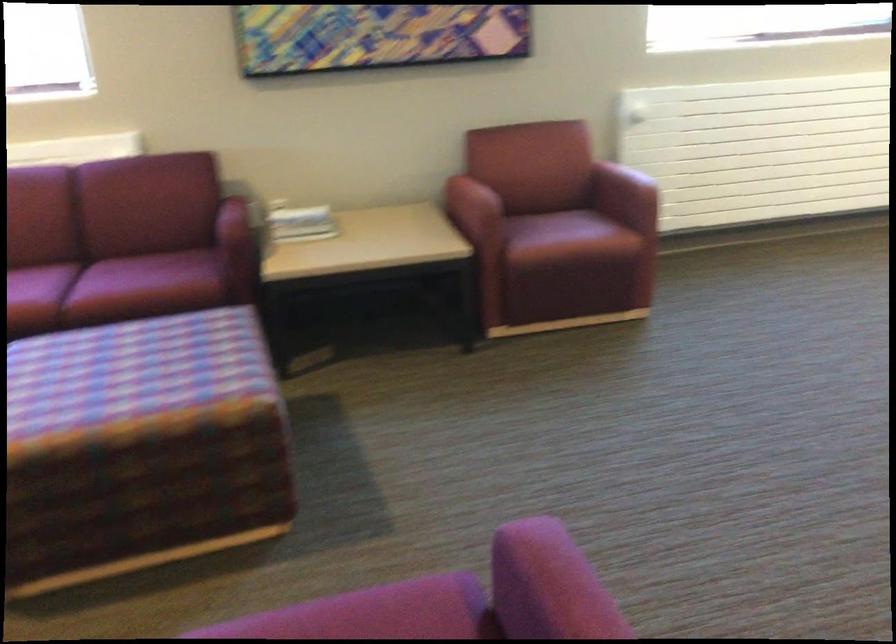
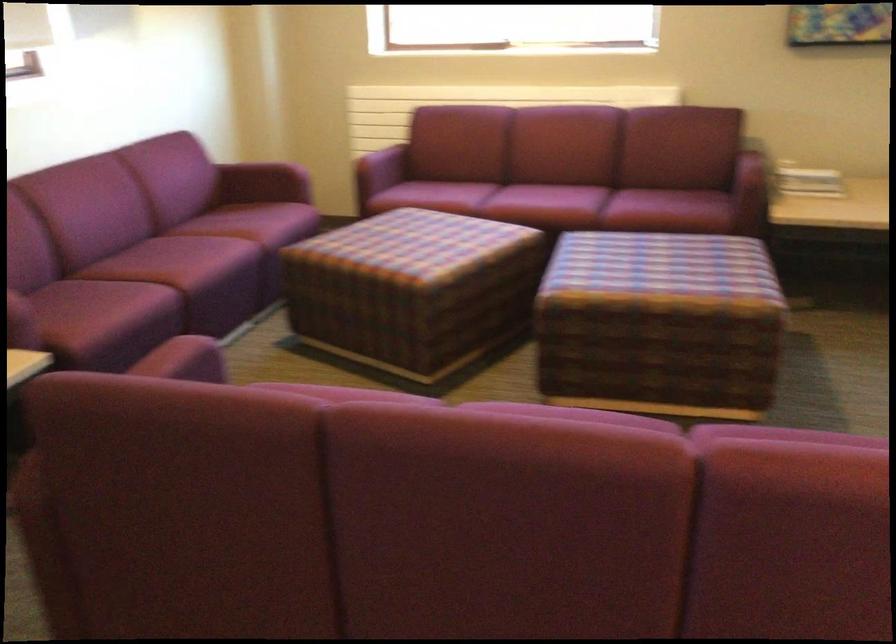
In the second image, find the point that corresponds to point (297, 228) in the first image.

(807, 180)